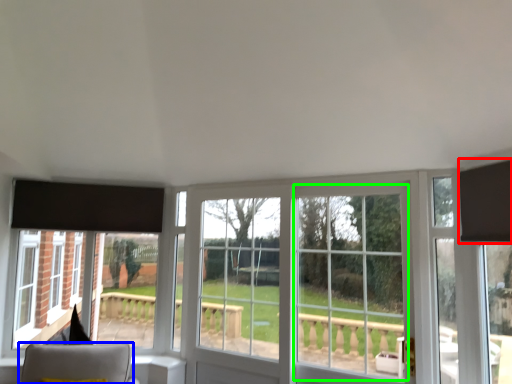
Question: Which is farther away from curtain (highlighted by a red box)? furniture (highlighted by a blue box) or glass door (highlighted by a green box)?

Choices:
 (A) furniture
 (B) glass door

Answer: (A)